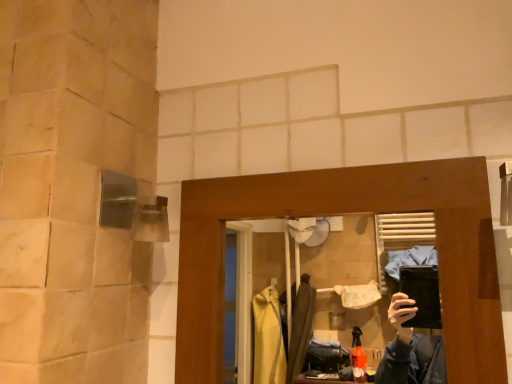
You are a GUI agent. You are given a task and a screenshot of the screen. Output one action in this format:
    pyautogui.click(x=<x>, y=<y>)
    Task: Click on the brown wooden door at center
    The image size is (512, 384).
    Given the screenshot: What is the action you would take?
    pyautogui.click(x=348, y=213)

Describe the element at coordinates (348, 213) in the screenshot. I see `brown wooden door at center` at that location.

Locate an element on the screen. brown wooden door at center is located at coordinates (348, 213).